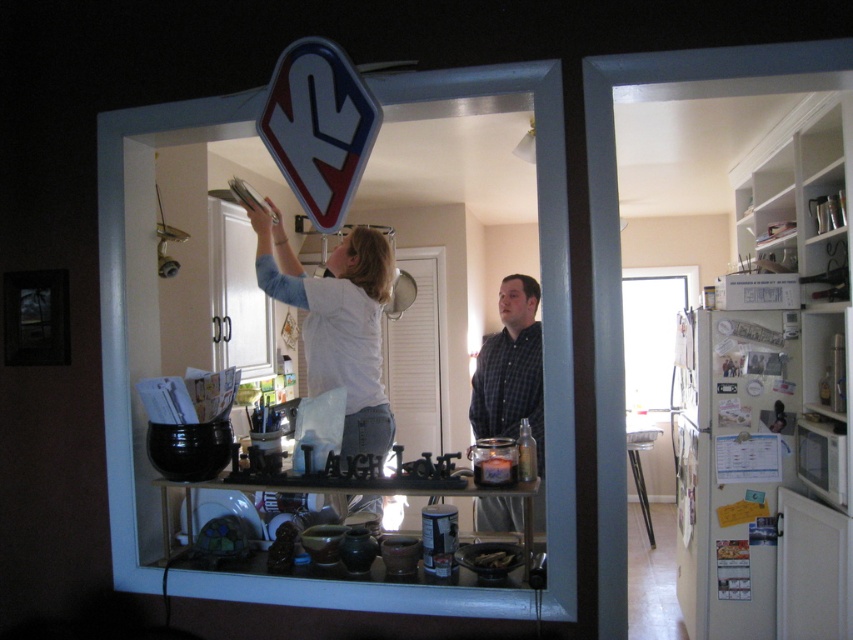
Question: Does white matte shirt at upper center appear under metallic blue and white traffic sign at upper center?

Choices:
 (A) yes
 (B) no

Answer: (A)

Question: Does metallic blue and white traffic sign at upper center have a larger size compared to checkered fabric shirt at center?

Choices:
 (A) yes
 (B) no

Answer: (B)

Question: Is metallic blue and white traffic sign at upper center closer to the viewer compared to checkered fabric shirt at center?

Choices:
 (A) no
 (B) yes

Answer: (B)

Question: Among these objects, which one is nearest to the camera?

Choices:
 (A) white matte shirt at upper center
 (B) metallic blue and white traffic sign at upper center

Answer: (B)

Question: Which object is farther from the camera taking this photo?

Choices:
 (A) checkered fabric shirt at center
 (B) white matte shirt at upper center

Answer: (B)

Question: Which object is closer to the camera taking this photo?

Choices:
 (A) metallic blue and white traffic sign at upper center
 (B) white matte shirt at upper center
 (C) checkered fabric shirt at center

Answer: (A)